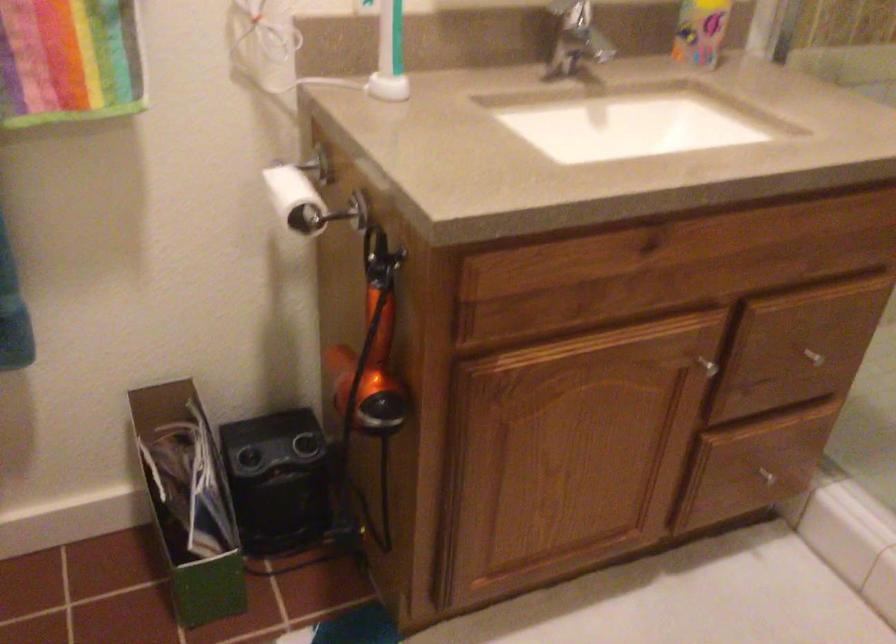
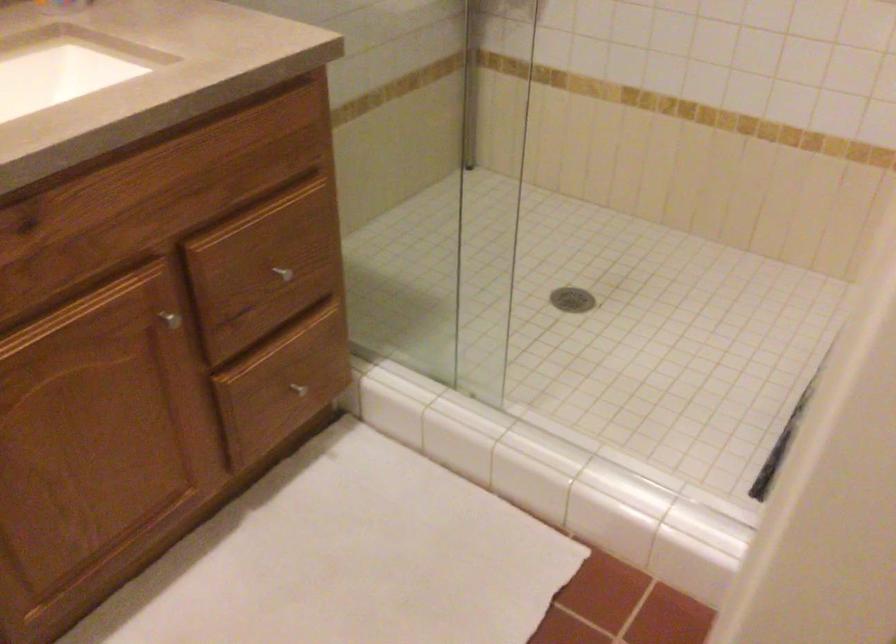
Question: How did the camera likely rotate?

Choices:
 (A) Left
 (B) Right
 (C) Up
 (D) Down

Answer: (B)